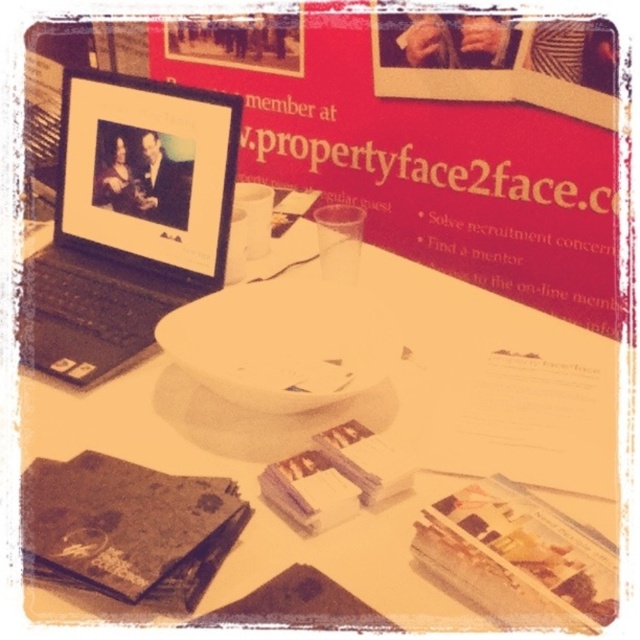
You are a guest at this event and want to place a cup on the white glossy plate at upper center. However, there is a white matte saucer at center in the way. Can you place the cup directly on the plate without moving the saucer?

The white glossy plate at upper center is closer to the viewer than the white matte saucer at center, so you can place the cup directly on the plate without moving the saucer since it is in front of the saucer.

You are organizing a bookshelf and need to place the matte paper book at center and the matte brown book at center next to each other. Given that the shelf space available is 7 inches wide, will both books fit side by side without overlapping?

The matte paper book at center and the matte brown book at center are 3.72 inches apart, so together they require a total width of 3.72 inches plus the sum of their individual widths. However, since the available shelf space is 7 inches, it depends on the total width of both books. Without knowing their individual sizes, we cannot definitively say if they will fit. The distance between them is 3.72 inches, but this does not account for their own dimensions.